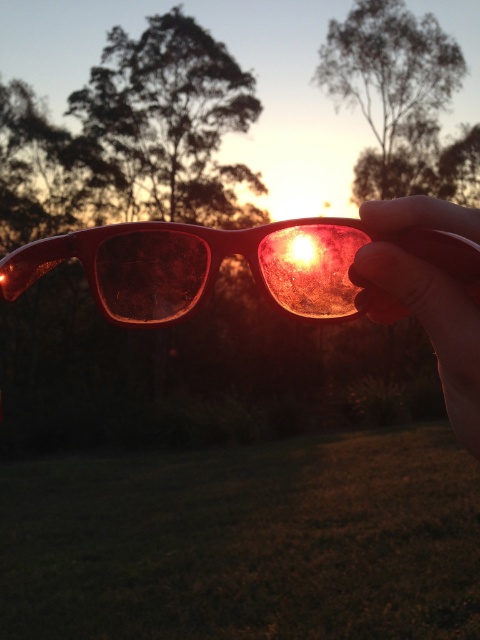
Question: Which point is farther from the camera taking this photo?

Choices:
 (A) (468, 403)
 (B) (112, 248)

Answer: (B)

Question: Can you confirm if matte plastic goggles at center is positioned below matte plastic hand at center?

Choices:
 (A) yes
 (B) no

Answer: (B)

Question: Does matte plastic goggles at center appear on the left side of matte plastic hand at center?

Choices:
 (A) no
 (B) yes

Answer: (B)

Question: Is matte plastic goggles at center further to the viewer compared to matte plastic hand at center?

Choices:
 (A) yes
 (B) no

Answer: (A)